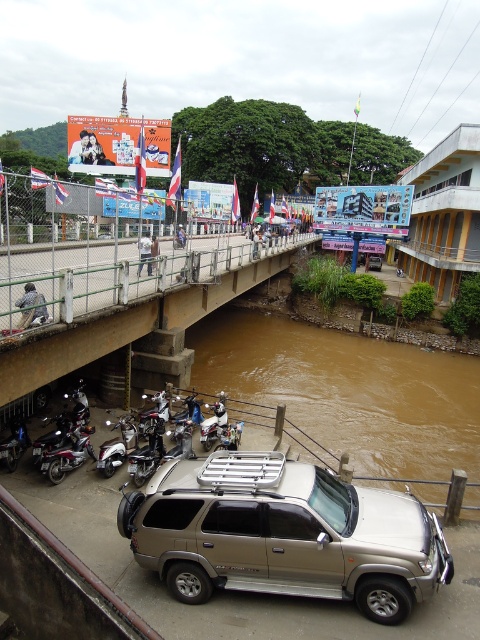
Question: Can you confirm if silver metallic suv at center is wider than brown muddy water at lower center?

Choices:
 (A) yes
 (B) no

Answer: (B)

Question: Which point appears farthest from the camera in this image?

Choices:
 (A) (361, 406)
 (B) (219, 280)
 (C) (405, 561)

Answer: (A)

Question: Which point is farther to the camera?

Choices:
 (A) brown muddy water at lower center
 (B) brown concrete bridge at lower left

Answer: (A)

Question: Which point appears farthest from the camera in this image?

Choices:
 (A) (331, 451)
 (B) (120, 515)

Answer: (A)

Question: Is brown muddy water at lower center to the left of brown concrete bridge at lower left from the viewer's perspective?

Choices:
 (A) no
 (B) yes

Answer: (A)

Question: Does silver metallic suv at center appear on the right side of brown muddy water at lower center?

Choices:
 (A) no
 (B) yes

Answer: (A)